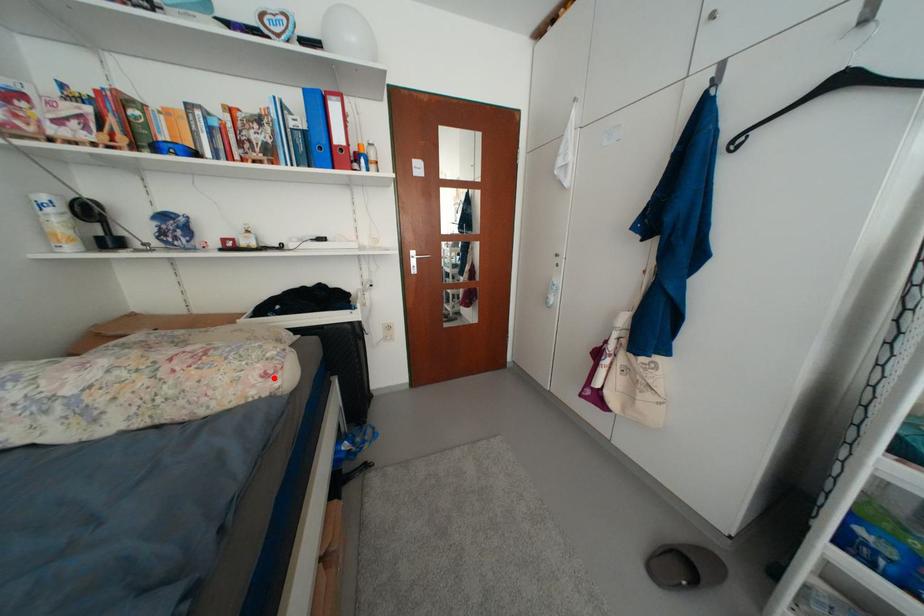
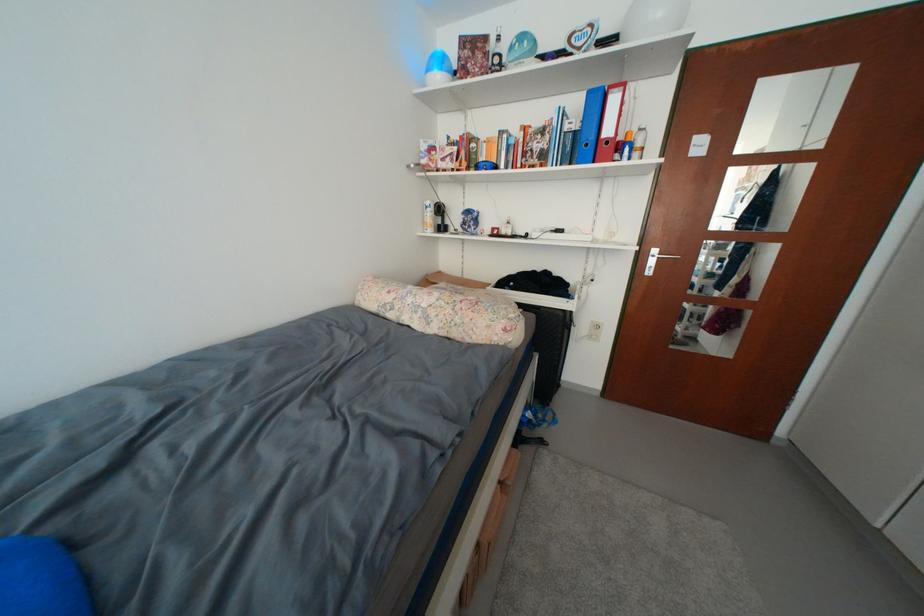
The point at the highlighted location is marked in the first image. Where is the corresponding point in the second image?

(514, 331)